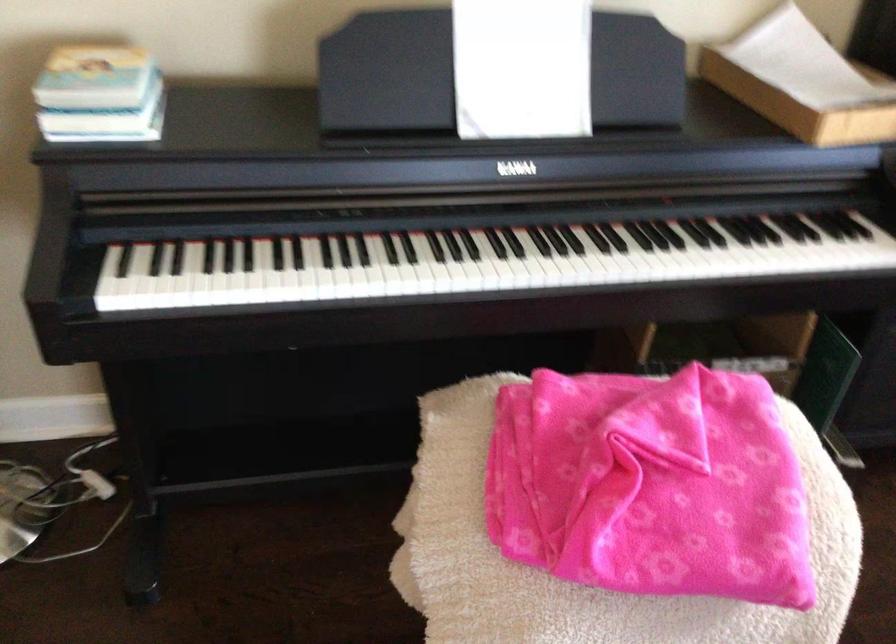
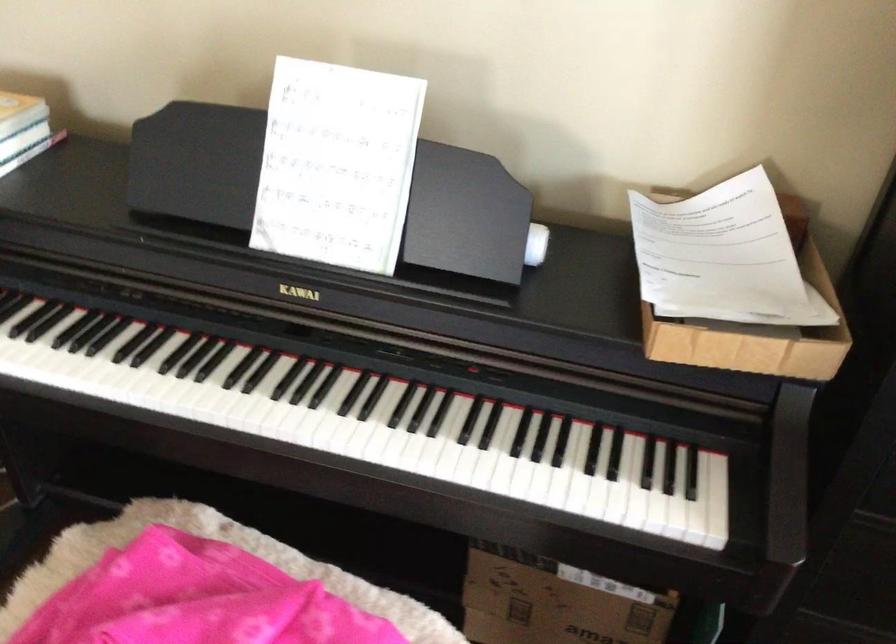
Find the pixel in the second image that matches pixel 478 268 in the first image.

(177, 397)